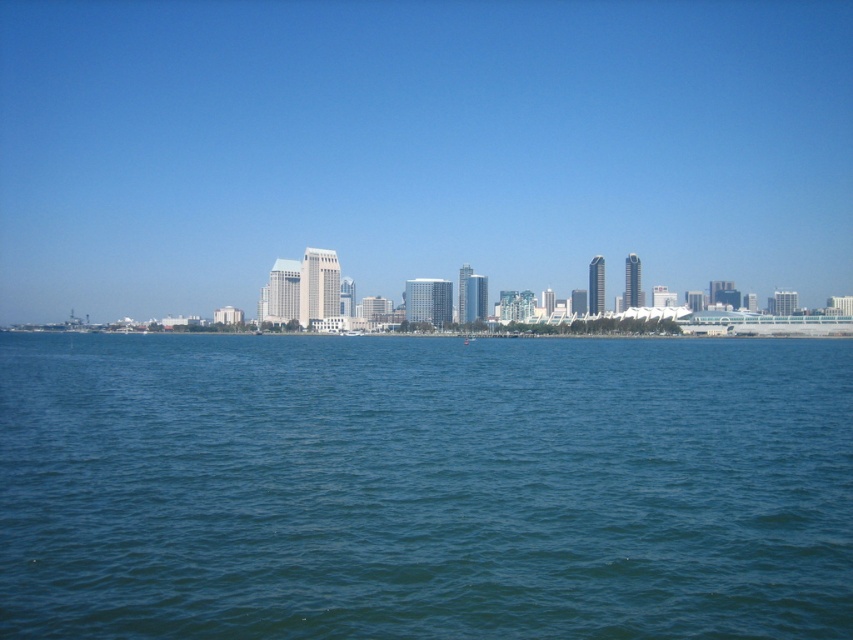
You are a photographer planning to capture the city skyline and the water in the image. Given that the blue water at center and the transparent glass skyline at center are both in your frame, which one appears narrower in the photo?

The blue water at center appears narrower because its width is less than that of the transparent glass skyline at center.

You are standing on the shore and want to take a photo of both the blue water at center and the transparent glass skyline at center. Based on their positions, which object should you adjust your camera to focus on first to ensure both are in the frame?

Since the blue water at center is to the right of the transparent glass skyline at center, you should first focus on the transparent glass skyline at center to ensure both are included in the frame.

You are standing at the point marked as point (x=424, y=486) in the image. What do you see directly in front of you?

You are standing at the point marked as point (x=424, y=486), which is the location of the blue water at center. Therefore, directly in front of you is the blue water at center.